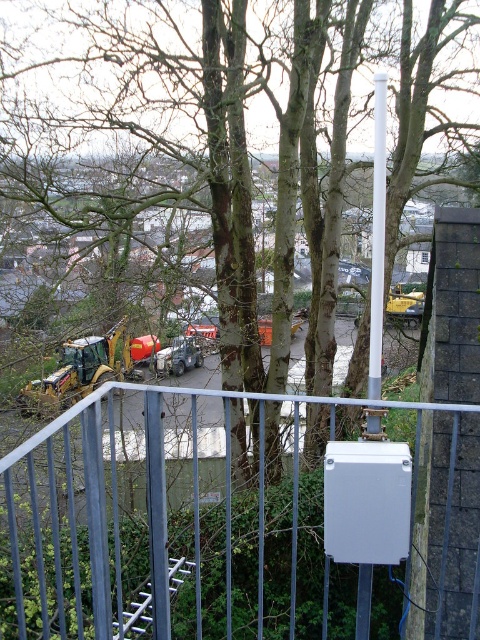
Question: Does metallic gray fence at center appear under yellow metallic excavator at lower left?

Choices:
 (A) no
 (B) yes

Answer: (B)

Question: Which point is farther to the camera?

Choices:
 (A) (129, 349)
 (B) (154, 458)

Answer: (A)

Question: Which of the following is the closest to the observer?

Choices:
 (A) metallic gray fence at center
 (B) yellow metallic excavator at lower left

Answer: (A)

Question: Can you confirm if metallic gray fence at center is bigger than yellow metallic excavator at lower left?

Choices:
 (A) yes
 (B) no

Answer: (A)

Question: Is metallic gray fence at center closer to camera compared to yellow metallic excavator at lower left?

Choices:
 (A) yes
 (B) no

Answer: (A)

Question: Which point is closer to the camera?

Choices:
 (A) yellow metallic excavator at lower left
 (B) metallic gray fence at center

Answer: (B)